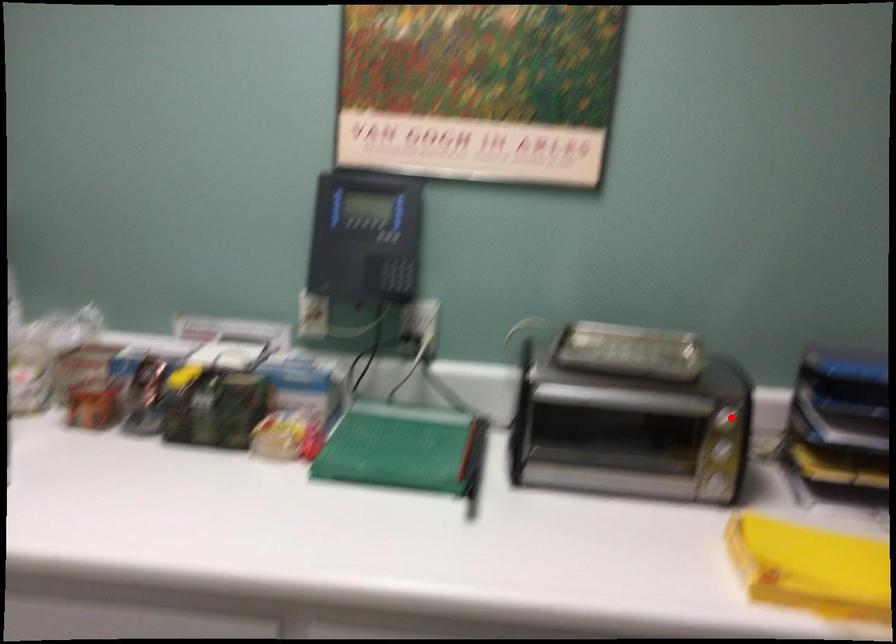
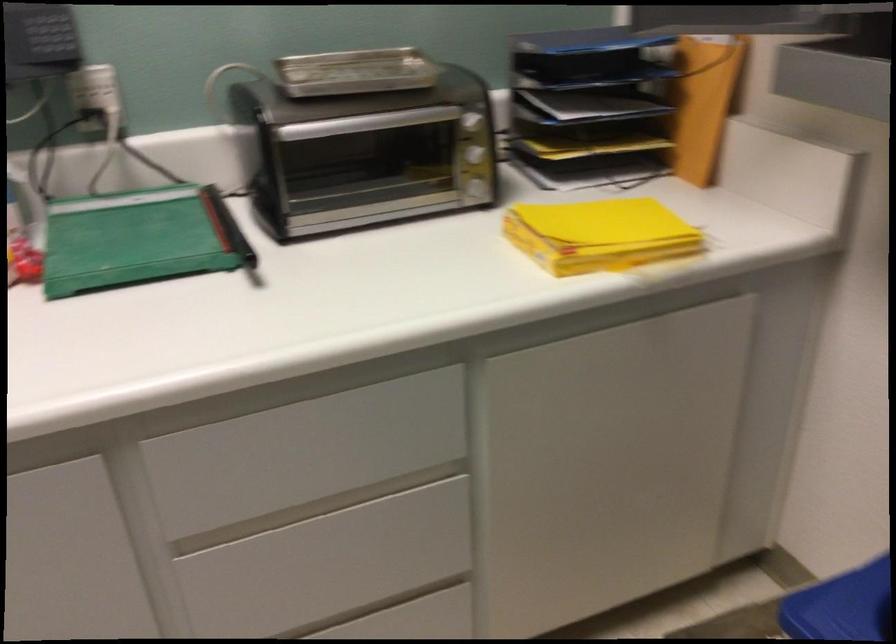
Find the pixel in the second image that matches the highlighted location in the first image.

(471, 120)